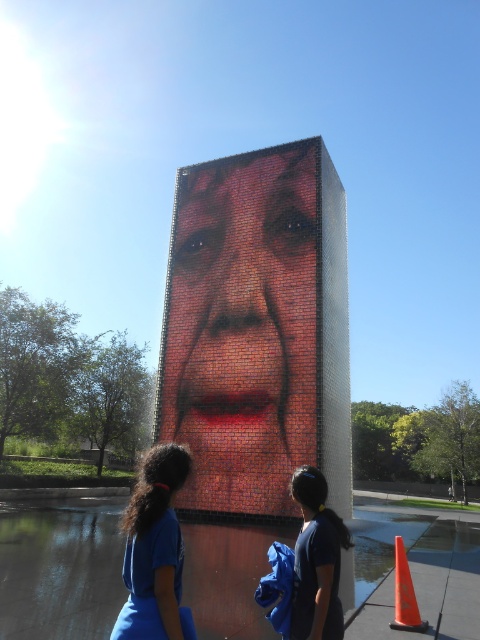
You are standing at the edge of the reflective pool in the scene. You want to walk to the glossy concrete pavement at lower center, which is at point (x=60, y=570). Is the path between you and the pavement clear? Please explain.

The glossy concrete pavement at lower center is located at point (x=60, y=570). Since the two individuals are standing near the edge of the reflective pool, and there is no mention of any obstacles between them and the pavement in the scene description, the path should be clear.

You are a photographer trying to capture the entire structure and the two people in one shot. Given that the glossy concrete pavement at lower center and the blue fabric ponytail at lower left are both in your viewfinder, which object will occupy more of the frame?

The glossy concrete pavement at lower center occupies more of the frame because it is bigger than the blue fabric ponytail at lower left according to the description.

You are standing at the edge of the reflective pool and want to walk towards the glossy concrete pavement at lower center. Which direction should you move relative to the blue fabric ponytail at lower left?

The glossy concrete pavement at lower center is to the right of the blue fabric ponytail at lower left, so you should move to the right relative to the blue fabric ponytail at lower left to reach it.